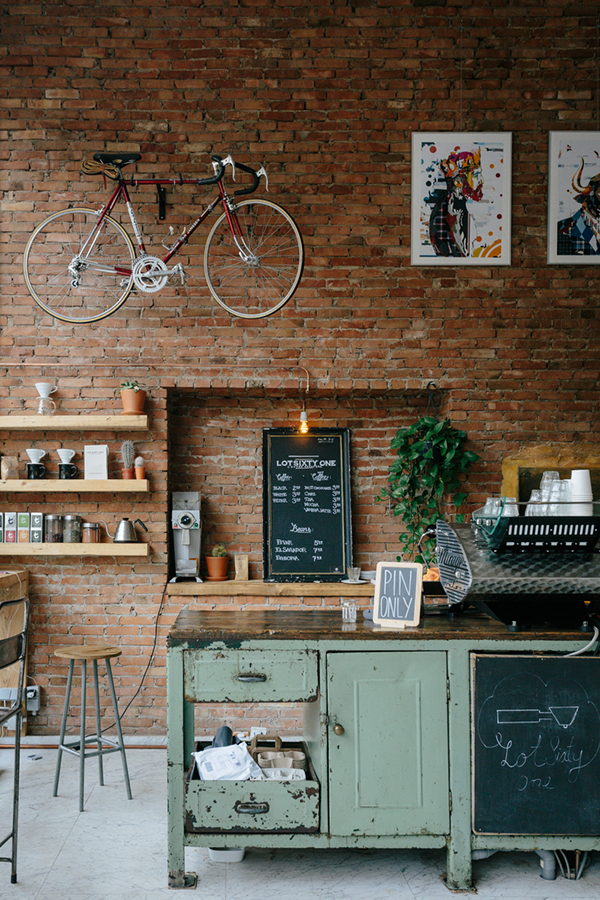
In order to click on things hung on wall in this screenshot , I will do `click(121, 185)`, `click(443, 180)`, `click(557, 186)`, `click(113, 425)`, `click(98, 490)`, `click(107, 544)`.